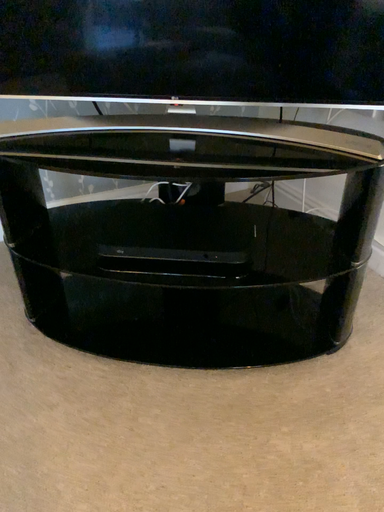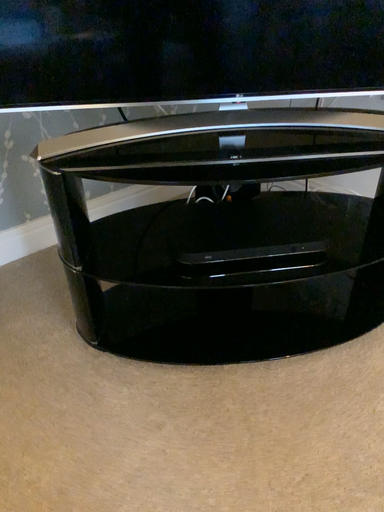
Question: How did the camera likely rotate when shooting the video?

Choices:
 (A) rotated left
 (B) rotated right

Answer: (B)